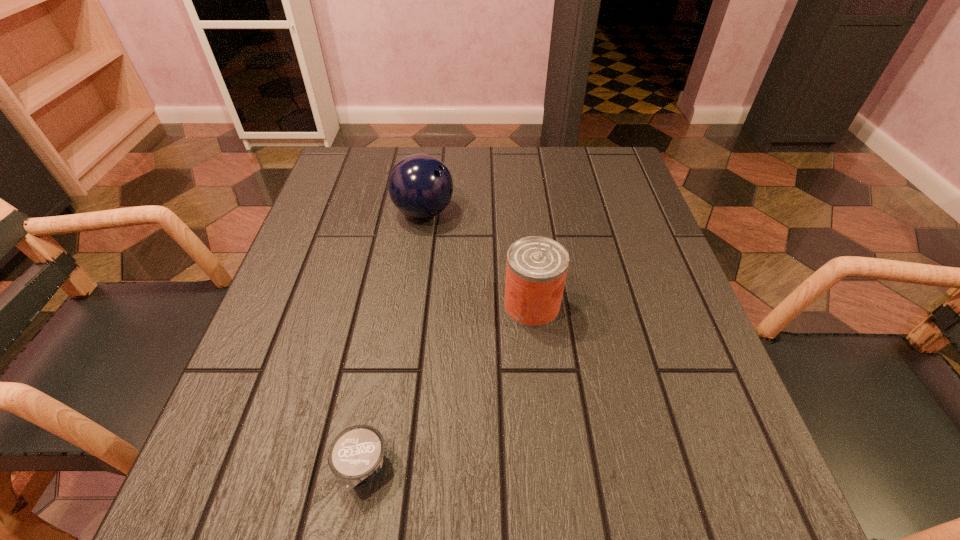
Where is `vacant point located between the farthest object and the nearest object`? Image resolution: width=960 pixels, height=540 pixels. vacant point located between the farthest object and the nearest object is located at coordinates (393, 341).

Locate an element on the screen. free space between the farthest object and the yogurt is located at coordinates (393, 341).

Locate an element on the screen. free space between the nearest object and the farthest object is located at coordinates (393, 341).

You are a GUI agent. You are given a task and a screenshot of the screen. Output one action in this format:
    pyautogui.click(x=<x>, y=<y>)
    Task: Click on the vacant space that's between the farthest object and the nearest object
    Image resolution: width=960 pixels, height=540 pixels.
    Given the screenshot: What is the action you would take?
    pyautogui.click(x=393, y=341)

Image resolution: width=960 pixels, height=540 pixels. I want to click on free area in between the rightmost object and the yogurt, so pos(446,387).

At what (x,y) coordinates should I click in order to perform the action: click on unoccupied area between the second farthest object and the farthest object. Please return your answer as a coordinate pair (x, y). This screenshot has width=960, height=540. Looking at the image, I should click on (478, 259).

Find the location of a particular element. free space between the yogurt and the farthest object is located at coordinates (393, 341).

Where is `object that is the closest to the shortest object`? This screenshot has height=540, width=960. object that is the closest to the shortest object is located at coordinates (536, 269).

Select which object appears as the second closest to the shortest object. Please provide its 2D coordinates. Your answer should be formatted as a tuple, i.e. [(x, y)], where the tuple contains the x and y coordinates of a point satisfying the conditions above.

[(420, 186)]

Locate an element on the screen. This screenshot has width=960, height=540. free space that satisfies the following two spatial constraints: 1. on the surface of the second farthest object near the finger holes; 2. on the right side of the farthest object is located at coordinates (411, 306).